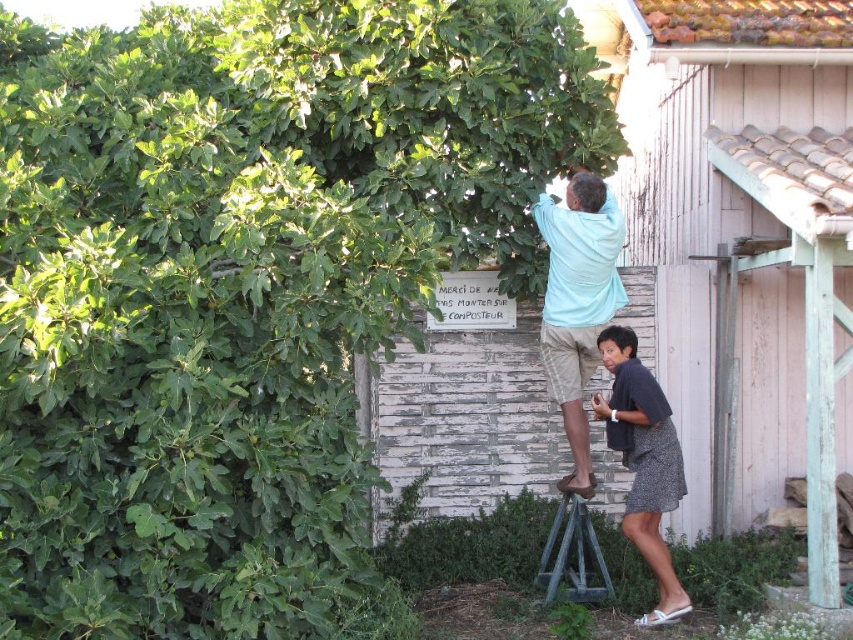
Is green leafy tree at upper left to the left of light blue cotton shirt at upper center from the viewer's perspective?

Indeed, green leafy tree at upper left is positioned on the left side of light blue cotton shirt at upper center.

Between green leafy tree at upper left and light blue cotton shirt at upper center, which one appears on the right side from the viewer's perspective?

Positioned to the right is light blue cotton shirt at upper center.

This screenshot has height=640, width=853. Identify the location of green leafy tree at upper left. (242, 284).

Locate an element on the screen. green leafy tree at upper left is located at coordinates (242, 284).

Is green leafy tree at upper left taller than pink wood hut at upper right?

In fact, green leafy tree at upper left may be shorter than pink wood hut at upper right.

Between point (312, 608) and point (791, 353), which one is positioned in front?

Point (312, 608) is more forward.

Who is more distant from viewer, (x=260, y=620) or (x=801, y=152)?

The point (x=801, y=152) is behind.

Find the location of `green leafy tree at upper left`. green leafy tree at upper left is located at coordinates (242, 284).

Is point (554, 240) in front of point (662, 596)?

No.

Find the location of a particular element. The image size is (853, 640). light blue cotton shirt at upper center is located at coordinates (577, 301).

What do you see at coordinates (577, 301) in the screenshot?
I see `light blue cotton shirt at upper center` at bounding box center [577, 301].

Locate an element on the screen. The image size is (853, 640). light blue cotton shirt at upper center is located at coordinates (577, 301).